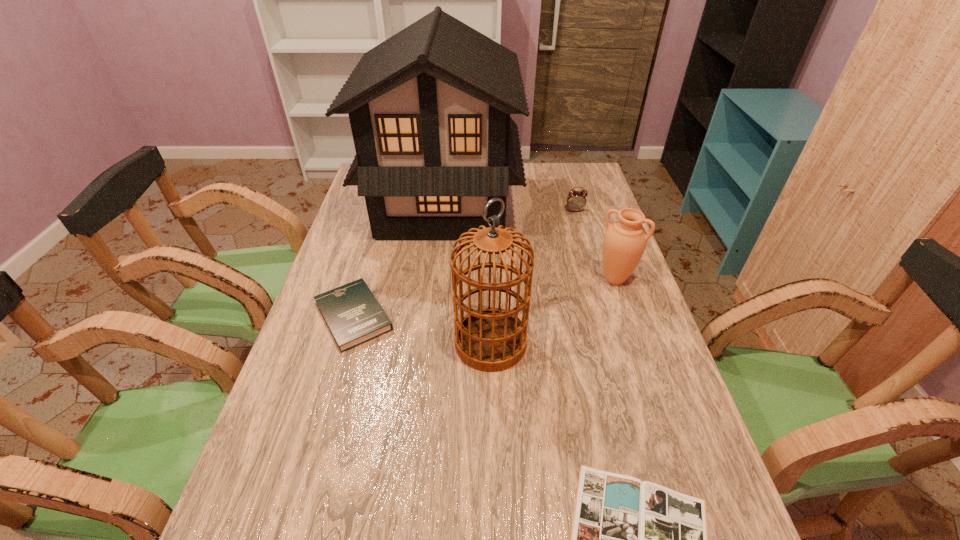
The height and width of the screenshot is (540, 960). In order to click on dollhouse in this screenshot , I will do `click(429, 108)`.

This screenshot has height=540, width=960. What are the coordinates of `birdcage` in the screenshot? It's located at (489, 339).

The height and width of the screenshot is (540, 960). What are the coordinates of `the third tallest object` in the screenshot? It's located at (625, 240).

At what (x,y) coordinates should I click in order to perform the action: click on alarm clock. Please return your answer as a coordinate pair (x, y). This screenshot has height=540, width=960. Looking at the image, I should click on (576, 200).

You are a GUI agent. You are given a task and a screenshot of the screen. Output one action in this format:
    pyautogui.click(x=<x>, y=<y>)
    Task: Click on the taller book
    The height and width of the screenshot is (540, 960).
    Given the screenshot: What is the action you would take?
    pyautogui.click(x=353, y=315)

At what (x,y) coordinates should I click in order to perform the action: click on the farther book. Please return your answer as a coordinate pair (x, y). The image size is (960, 540). Looking at the image, I should click on (353, 315).

Identify the location of free space located on the front-facing side of the dollhouse. The image size is (960, 540). (575, 204).

You are a GUI agent. You are given a task and a screenshot of the screen. Output one action in this format:
    pyautogui.click(x=<x>, y=<y>)
    Task: Click on the free point located 0.050m on the right of the second tallest object
    The width and height of the screenshot is (960, 540).
    Given the screenshot: What is the action you would take?
    pyautogui.click(x=546, y=343)

This screenshot has width=960, height=540. I want to click on vacant space located on the left of the third tallest object, so click(494, 279).

Locate an element on the screen. The width and height of the screenshot is (960, 540). blank area located 0.200m on the face of the fourth tallest object is located at coordinates (586, 249).